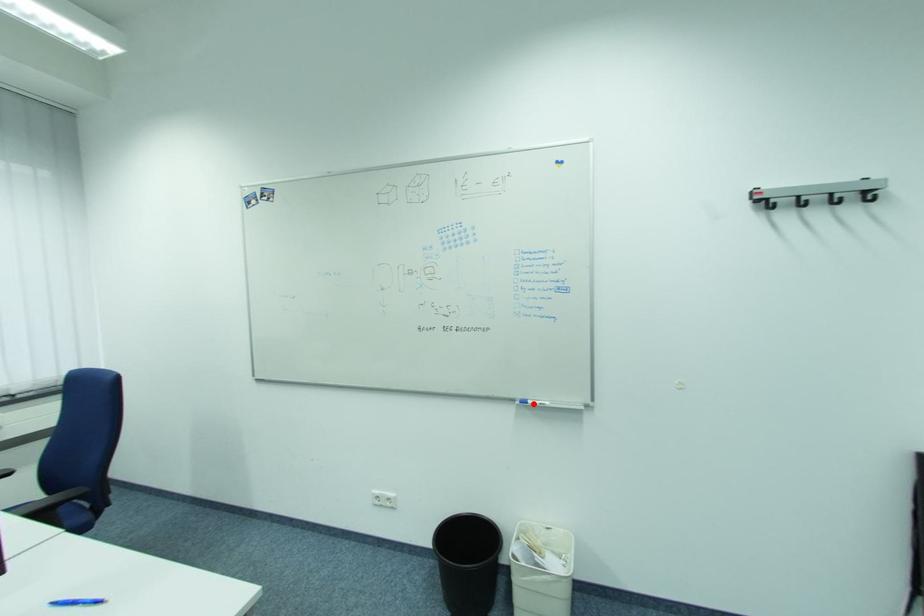
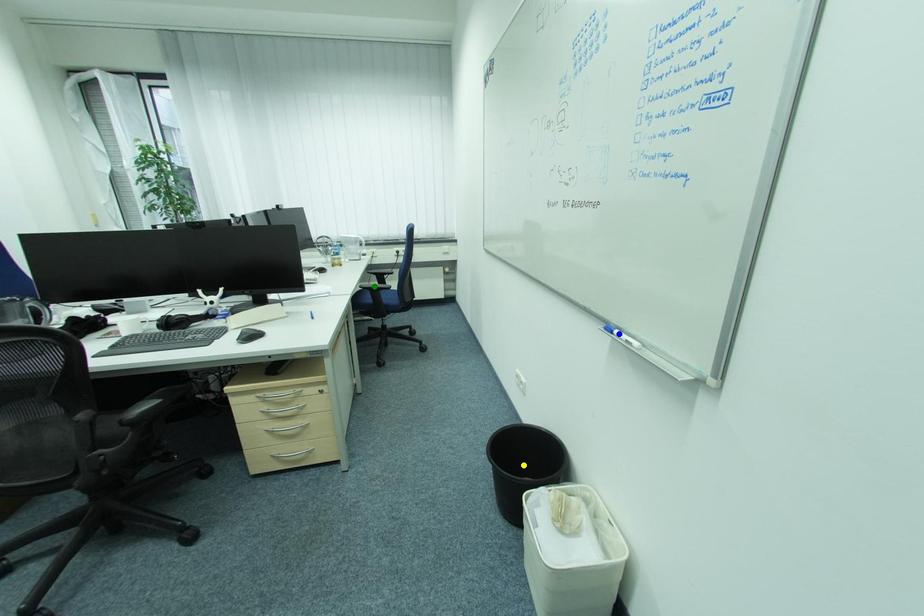
Question: I am providing you with two images of the same scene from different viewpoints. A red point is marked on the first image. You are given multiple points on the second image. Which point in image 2 represents the same 3d spot as the red point in image 1?

Choices:
 (A) green point
 (B) yellow point
 (C) blue point

Answer: (C)